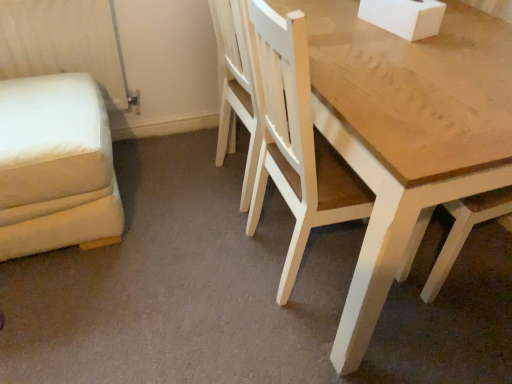
Question: Can you confirm if light wood chair at center is taller than white fabric swivel chair at left?

Choices:
 (A) no
 (B) yes

Answer: (B)

Question: Is light wood chair at center aimed at white fabric swivel chair at left?

Choices:
 (A) no
 (B) yes

Answer: (A)

Question: From a real-world perspective, is light wood chair at center located beneath white fabric swivel chair at left?

Choices:
 (A) yes
 (B) no

Answer: (B)

Question: Is light wood chair at center far away from white fabric swivel chair at left?

Choices:
 (A) no
 (B) yes

Answer: (A)

Question: Is light wood chair at center outside of white fabric swivel chair at left?

Choices:
 (A) yes
 (B) no

Answer: (A)

Question: Can you confirm if light wood chair at center is thinner than white fabric swivel chair at left?

Choices:
 (A) yes
 (B) no

Answer: (A)

Question: Could you tell me if white fabric swivel chair at left is turned towards light wood chair at center?

Choices:
 (A) yes
 (B) no

Answer: (B)

Question: From the image's perspective, is white fabric swivel chair at left beneath light wood chair at center?

Choices:
 (A) yes
 (B) no

Answer: (A)

Question: Does white fabric swivel chair at left appear on the left side of light wood chair at center?

Choices:
 (A) yes
 (B) no

Answer: (A)

Question: Can you confirm if white fabric swivel chair at left is shorter than light wood chair at center?

Choices:
 (A) yes
 (B) no

Answer: (A)

Question: Is the position of white fabric swivel chair at left more distant than that of light wood chair at center?

Choices:
 (A) yes
 (B) no

Answer: (A)

Question: From the image's perspective, would you say white fabric swivel chair at left is positioned over light wood chair at center?

Choices:
 (A) no
 (B) yes

Answer: (A)

Question: From a real-world perspective, relative to light wood chair at center, is white fabric swivel chair at left vertically above or below?

Choices:
 (A) above
 (B) below

Answer: (B)